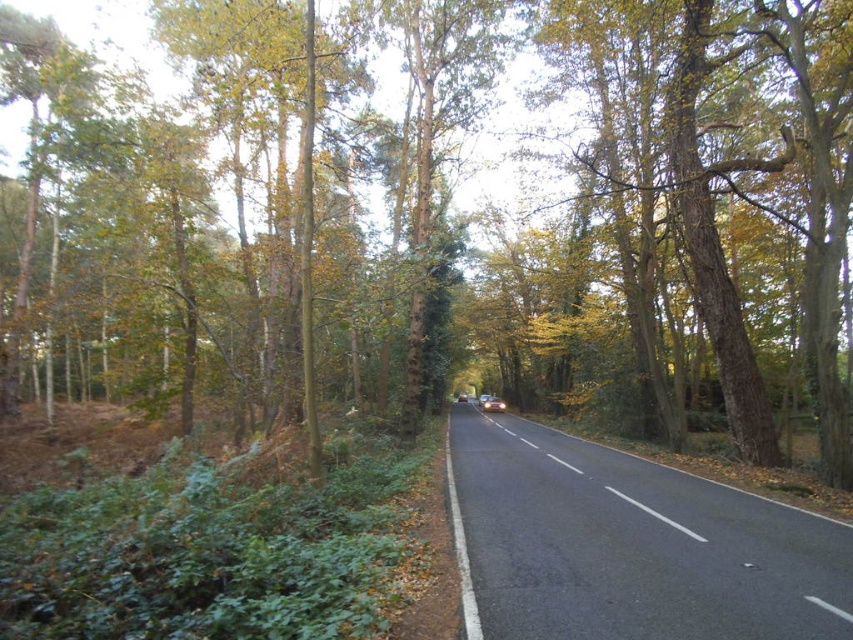
Who is lower down, black asphalt road at center or metallic silver car at center?

metallic silver car at center

This screenshot has height=640, width=853. I want to click on black asphalt road at center, so click(633, 545).

Locate an element on the screen. This screenshot has height=640, width=853. black asphalt road at center is located at coordinates (633, 545).

Identify the location of black asphalt road at center. This screenshot has width=853, height=640. click(x=633, y=545).